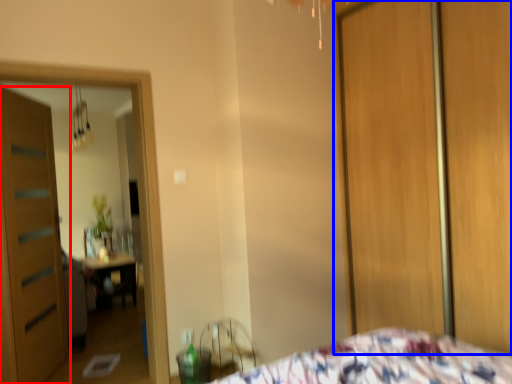
Question: Which point is closer to the camera, door (highlighted by a red box) or screen door (highlighted by a blue box)?

Choices:
 (A) door
 (B) screen door

Answer: (B)